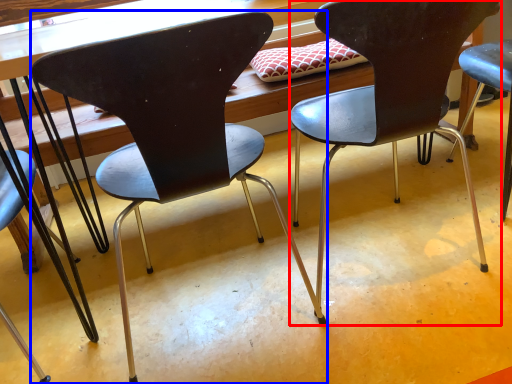
Question: Among these objects, which one is farthest to the camera, chair (highlighted by a red box) or chair (highlighted by a blue box)?

Choices:
 (A) chair
 (B) chair

Answer: (A)